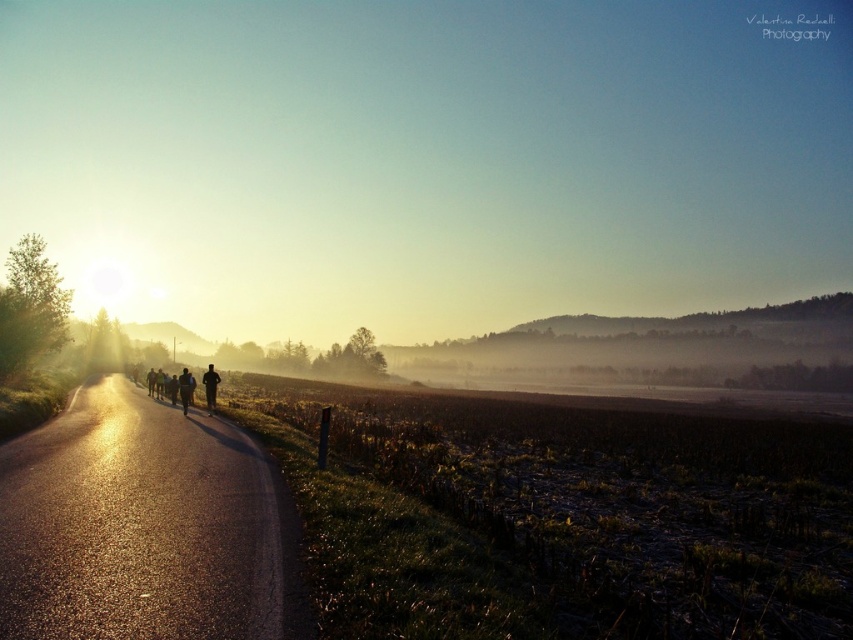
Is matte asphalt road at left taller than asphalt road at center?

Indeed, matte asphalt road at left has a greater height compared to asphalt road at center.

What do you see at coordinates (426, 157) in the screenshot? I see `matte asphalt road at left` at bounding box center [426, 157].

Between point (155, 104) and point (82, 604), which one is positioned in front?

Positioned in front is point (82, 604).

The image size is (853, 640). Find the location of `matte asphalt road at left`. matte asphalt road at left is located at coordinates point(426,157).

Does matte asphalt road at left appear under dark blue running suit at center?

No, matte asphalt road at left is not below dark blue running suit at center.

Consider the image. Who is lower down, matte asphalt road at left or dark blue running suit at center?

Positioned lower is dark blue running suit at center.

Identify the location of matte asphalt road at left. (426, 157).

Does matte asphalt road at left have a lesser width compared to silhouette running at left?

In fact, matte asphalt road at left might be wider than silhouette running at left.

Is matte asphalt road at left above silhouette running at left?

Indeed, matte asphalt road at left is positioned over silhouette running at left.

Locate an element on the screen. This screenshot has width=853, height=640. matte asphalt road at left is located at coordinates (426, 157).